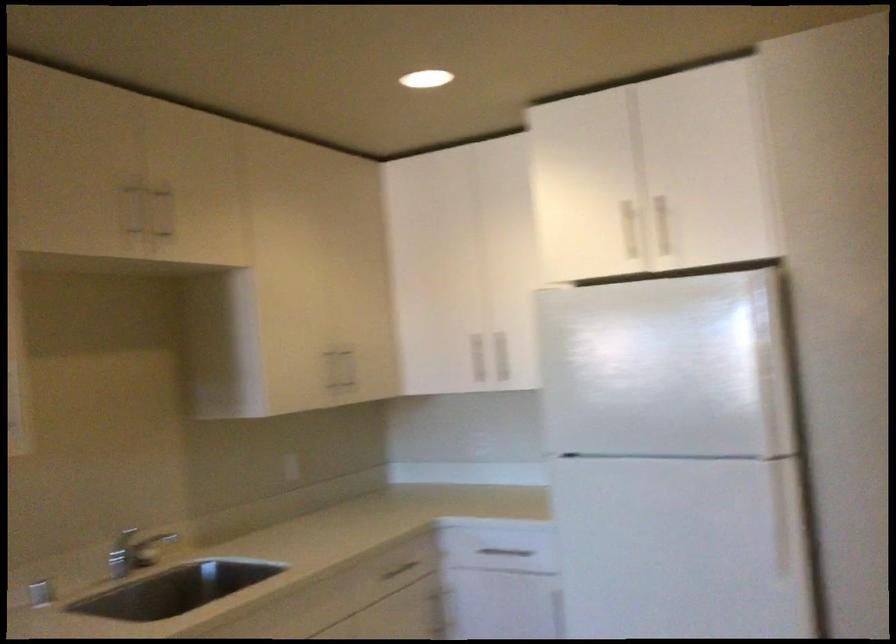
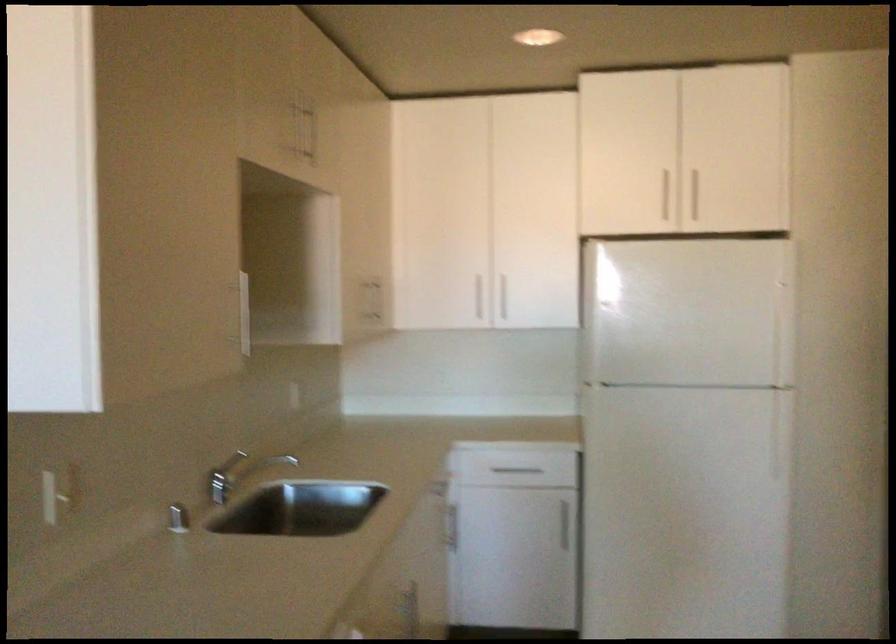
Find the pixel in the second image that matches point (642, 362) in the first image.

(687, 313)